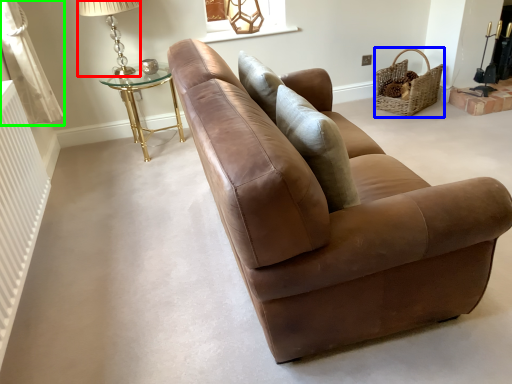
Question: Estimate the real-world distances between objects in this image. Which object is farther from table lamp (highlighted by a red box), basket (highlighted by a blue box) or curtain (highlighted by a green box)?

Choices:
 (A) basket
 (B) curtain

Answer: (A)